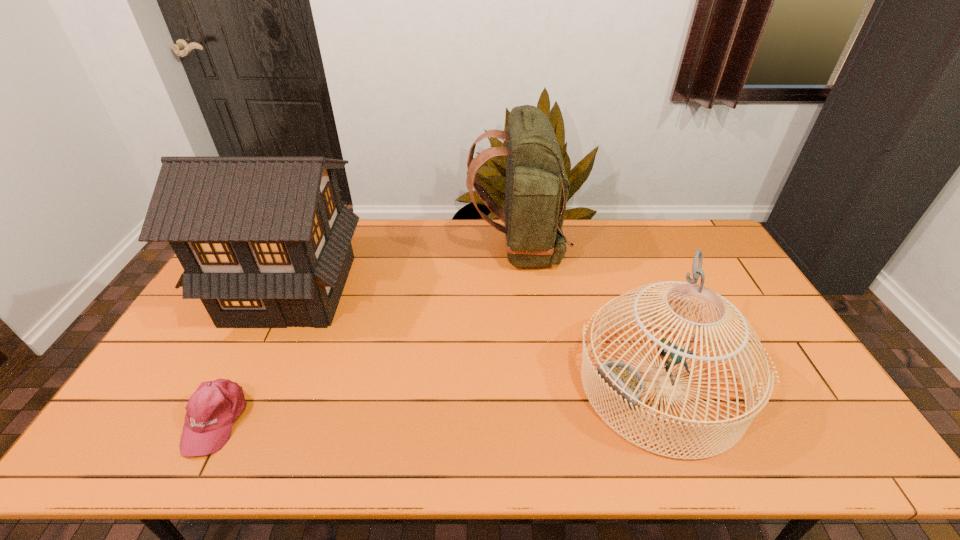
Find the location of a particular element. Image resolution: width=960 pixels, height=540 pixels. backpack is located at coordinates (536, 191).

I want to click on dollhouse, so click(265, 242).

What are the coordinates of `birdcage` in the screenshot? It's located at (627, 382).

What are the coordinates of `the shortest object` in the screenshot? It's located at (215, 405).

Where is `free space located 0.180m on the back of the backpack`? The height and width of the screenshot is (540, 960). free space located 0.180m on the back of the backpack is located at coordinates (419, 248).

You are a GUI agent. You are given a task and a screenshot of the screen. Output one action in this format:
    pyautogui.click(x=<x>, y=<y>)
    Task: Click on the free location located 0.130m on the back of the backpack
    The width and height of the screenshot is (960, 540).
    Given the screenshot: What is the action you would take?
    pyautogui.click(x=432, y=248)

Where is `free space located 0.290m on the back of the backpack`? free space located 0.290m on the back of the backpack is located at coordinates (388, 248).

Where is `free region located on the front-facing side of the dollhouse`? free region located on the front-facing side of the dollhouse is located at coordinates (x=239, y=397).

Find the location of a particular element. free location located on the left of the birdcage is located at coordinates (432, 383).

This screenshot has height=540, width=960. What are the coordinates of `backpack located at the far edge` in the screenshot? It's located at (536, 191).